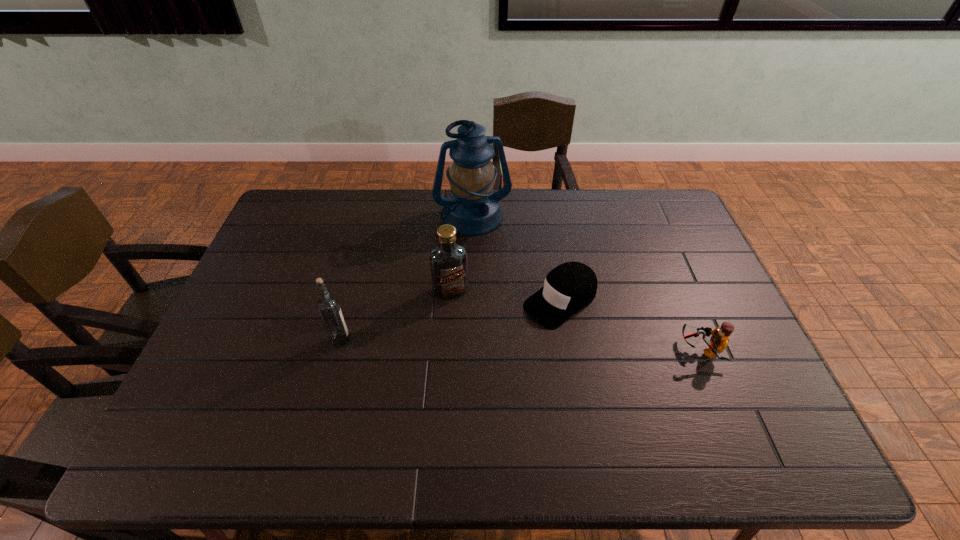
Where is `the leftmost object`? The image size is (960, 540). the leftmost object is located at coordinates (328, 306).

Locate an element on the screen. This screenshot has width=960, height=540. the nearer vodka is located at coordinates (328, 306).

Locate an element on the screen. the rightmost object is located at coordinates (719, 340).

In order to click on Lego in this screenshot , I will do `click(719, 340)`.

You are a GUI agent. You are given a task and a screenshot of the screen. Output one action in this format:
    pyautogui.click(x=<x>, y=<y>)
    Task: Click on the farthest object
    This screenshot has width=960, height=540.
    Given the screenshot: What is the action you would take?
    pyautogui.click(x=473, y=209)

Find the location of a particular element. the tallest object is located at coordinates (473, 209).

Locate an element on the screen. This screenshot has width=960, height=540. the second object from right to left is located at coordinates (571, 286).

The width and height of the screenshot is (960, 540). In order to click on the shortest object in this screenshot , I will do `click(571, 286)`.

This screenshot has width=960, height=540. I want to click on the farther vodka, so click(x=448, y=261).

Find the location of a particular element. This screenshot has height=540, width=960. vacant space located on the label of the leftmost object is located at coordinates (480, 340).